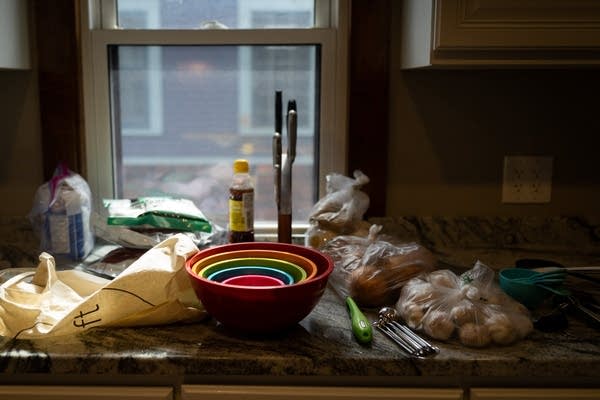
The image size is (600, 400). I want to click on sockets, so click(x=513, y=194), click(x=537, y=195), click(x=515, y=172), click(x=538, y=174).